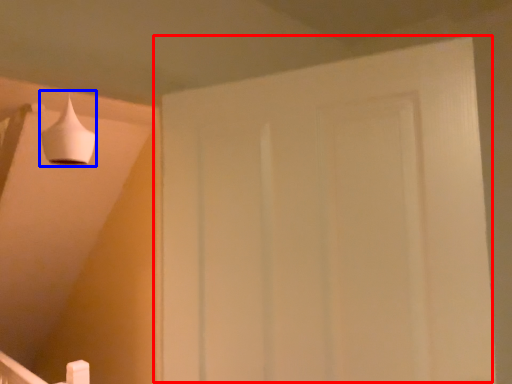
Question: Which point is closer to the camera, door (highlighted by a red box) or lamp (highlighted by a blue box)?

Choices:
 (A) door
 (B) lamp

Answer: (A)